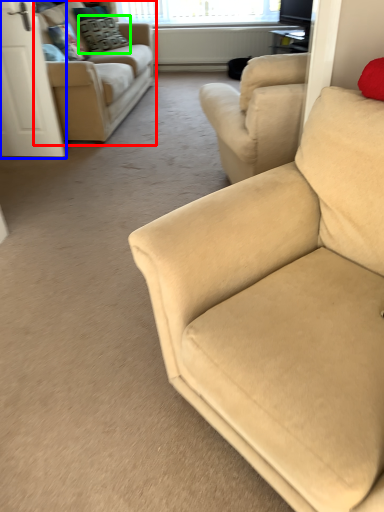
Question: Considering the real-world distances, which object is closest to studio couch (highlighted by a red box)? screen door (highlighted by a blue box) or pillow (highlighted by a green box).

Choices:
 (A) screen door
 (B) pillow

Answer: (A)